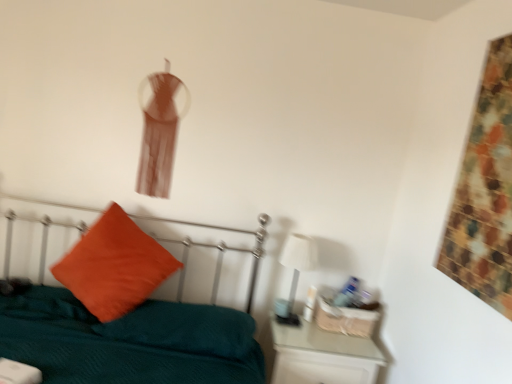
Question: From the image's perspective, is teal fabric bed at center positioned above or below orange velvet pillow at left?

Choices:
 (A) above
 (B) below

Answer: (B)

Question: Is teal fabric bed at center to the left or to the right of orange velvet pillow at left in the image?

Choices:
 (A) left
 (B) right

Answer: (B)

Question: Which is farther from the teal fabric bed at center?

Choices:
 (A) white glossy table lamp at right
 (B) orange velvet pillow at left
 (C) white glossy nightstand at lower right

Answer: (A)

Question: Estimate the real-world distances between objects in this image. Which object is farther from the white glossy nightstand at lower right?

Choices:
 (A) white glossy table lamp at right
 (B) orange velvet pillow at left
 (C) teal fabric bed at center

Answer: (B)